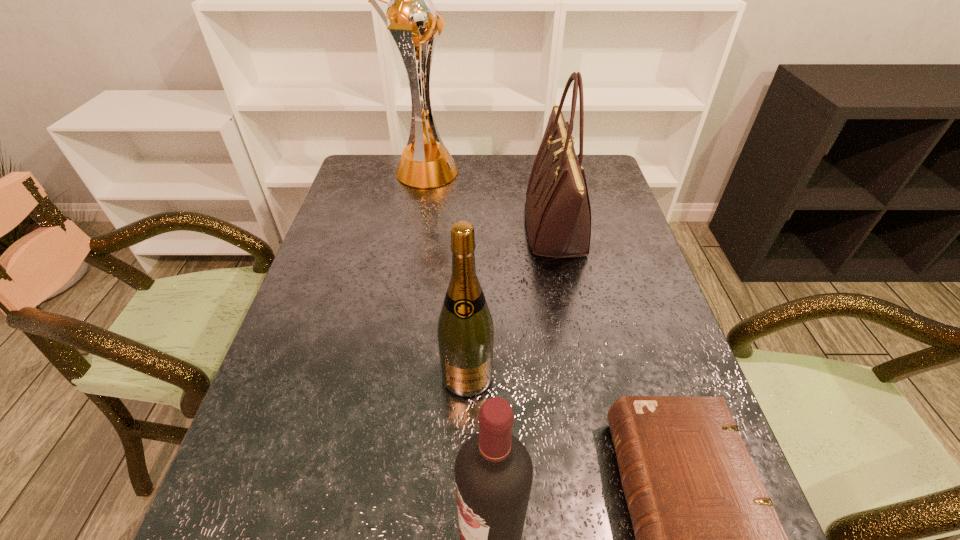
The width and height of the screenshot is (960, 540). I want to click on empty space between the third nearest object and the trophy, so click(446, 274).

Select which object is the second closest to the trophy. Please provide its 2D coordinates. Your answer should be formatted as a tuple, i.e. [(x, y)], where the tuple contains the x and y coordinates of a point satisfying the conditions above.

[(465, 330)]

Identify which object is the nearest to the handbag. Please provide its 2D coordinates. Your answer should be formatted as a tuple, i.e. [(x, y)], where the tuple contains the x and y coordinates of a point satisfying the conditions above.

[(410, 15)]

The image size is (960, 540). Find the location of `vacant region that satisfies the following two spatial constraints: 1. on the front-facing side of the handbag; 2. on the front-facing side of the farther wine bottle`. vacant region that satisfies the following two spatial constraints: 1. on the front-facing side of the handbag; 2. on the front-facing side of the farther wine bottle is located at coordinates point(587,376).

You are a GUI agent. You are given a task and a screenshot of the screen. Output one action in this format:
    pyautogui.click(x=<x>, y=<y>)
    Task: Click on the vacant space that satisfies the following two spatial constraints: 1. on the front-facing side of the handbag; 2. on the front-facing side of the farther wine bottle
    The width and height of the screenshot is (960, 540).
    Given the screenshot: What is the action you would take?
    pos(587,376)